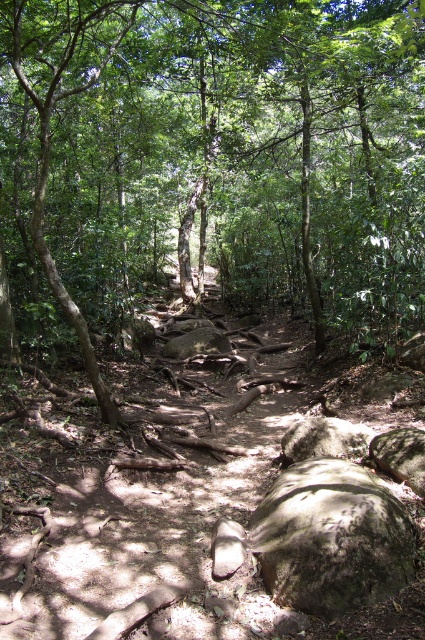
In the scene shown: Can you confirm if green leafy tree at center is positioned to the right of rough gray rock at lower right?

Incorrect, green leafy tree at center is not on the right side of rough gray rock at lower right.

At what (x,y) coordinates should I click in order to perform the action: click on green leafy tree at center. Please return your answer as a coordinate pair (x, y). Looking at the image, I should click on (215, 156).

Image resolution: width=425 pixels, height=640 pixels. Describe the element at coordinates (215, 156) in the screenshot. I see `green leafy tree at center` at that location.

Find the location of a particular element. Image resolution: width=425 pixels, height=640 pixels. green leafy tree at center is located at coordinates (215, 156).

Does green mossy rock at lower center have a greater height compared to gray rough rock at center?

Yes.

Based on the photo, who is more distant from viewer, (x=339, y=566) or (x=371, y=429)?

The point (x=371, y=429) is more distant.

This screenshot has width=425, height=640. I want to click on green mossy rock at lower center, so click(331, 538).

Is point (329, 531) positioned behind point (408, 460)?

No, (329, 531) is in front of (408, 460).

Locate an element on the screen. The width and height of the screenshot is (425, 640). green mossy rock at lower center is located at coordinates (331, 538).